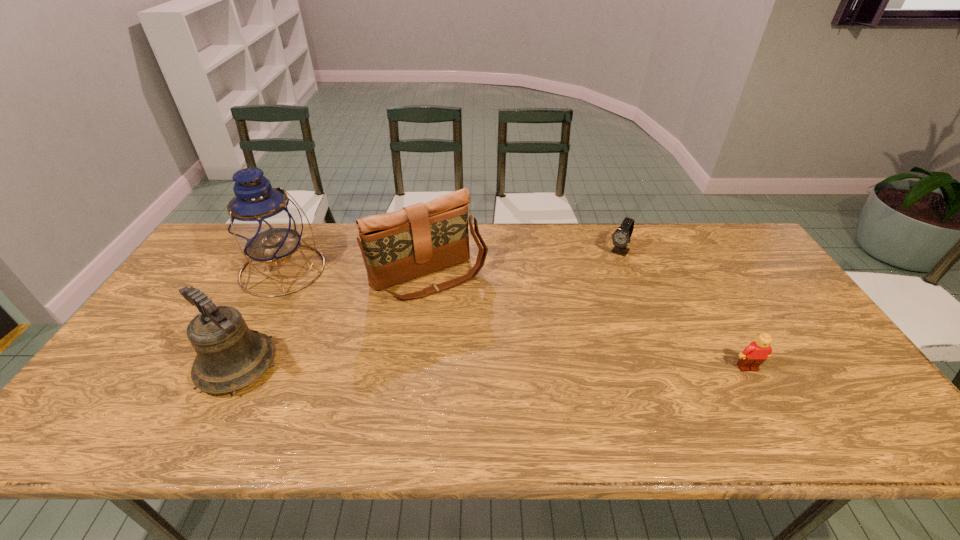
Where is `free point located 0.250m on the face of the fourth object from left to right`? free point located 0.250m on the face of the fourth object from left to right is located at coordinates (583, 305).

Identify the location of vacant space situated on the face of the fourth object from left to right. (560, 338).

The width and height of the screenshot is (960, 540). Identify the location of free location located 0.240m on the face of the fourth object from left to right. (585, 302).

The image size is (960, 540). Identify the location of vacant space located 0.290m on the front-facing side of the shoulder bag. (507, 374).

Where is `vacant space situated 0.080m on the front-facing side of the shoulder bag`? This screenshot has height=540, width=960. vacant space situated 0.080m on the front-facing side of the shoulder bag is located at coordinates (468, 319).

The image size is (960, 540). I want to click on vacant space situated on the front-facing side of the shoulder bag, so click(484, 341).

Find the location of a particular element. lantern present at the far edge is located at coordinates (263, 222).

This screenshot has width=960, height=540. I want to click on watch at the far edge, so click(621, 237).

Locate an element on the screen. Image resolution: width=960 pixels, height=540 pixels. shoulder bag that is at the far edge is located at coordinates (420, 239).

Identify the location of object that is at the near edge. This screenshot has height=540, width=960. (230, 356).